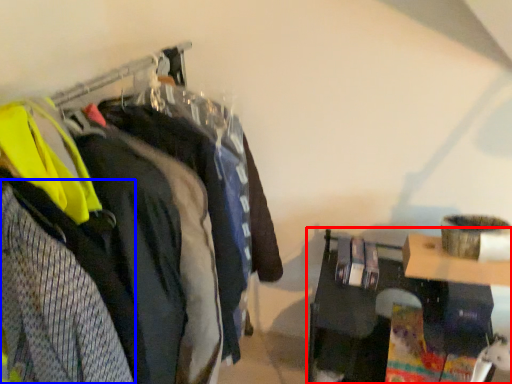
Question: Which object is closer to the camera taking this photo, furniture (highlighted by a red box) or clothing (highlighted by a blue box)?

Choices:
 (A) furniture
 (B) clothing

Answer: (B)